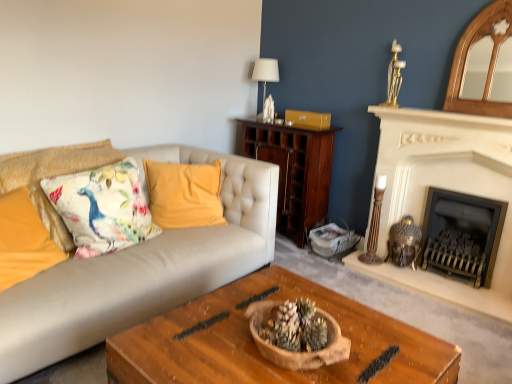
Identify the location of vacant space underneath wooden candle holder at right, placed as the first candle holder when sorted from bottom to top (from a real-world perspective). This screenshot has width=512, height=384. (373, 254).